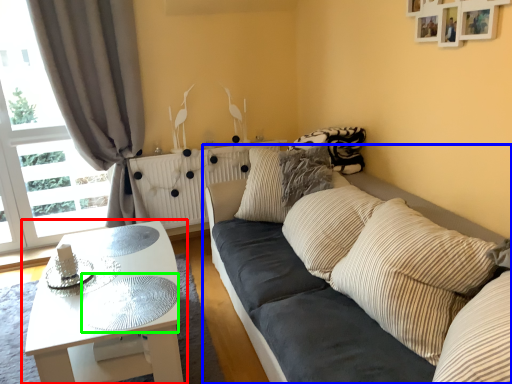
Question: Which is nearer to the coffee table (highlighted by a red box)? studio couch (highlighted by a blue box) or glass table (highlighted by a green box).

Choices:
 (A) studio couch
 (B) glass table

Answer: (B)